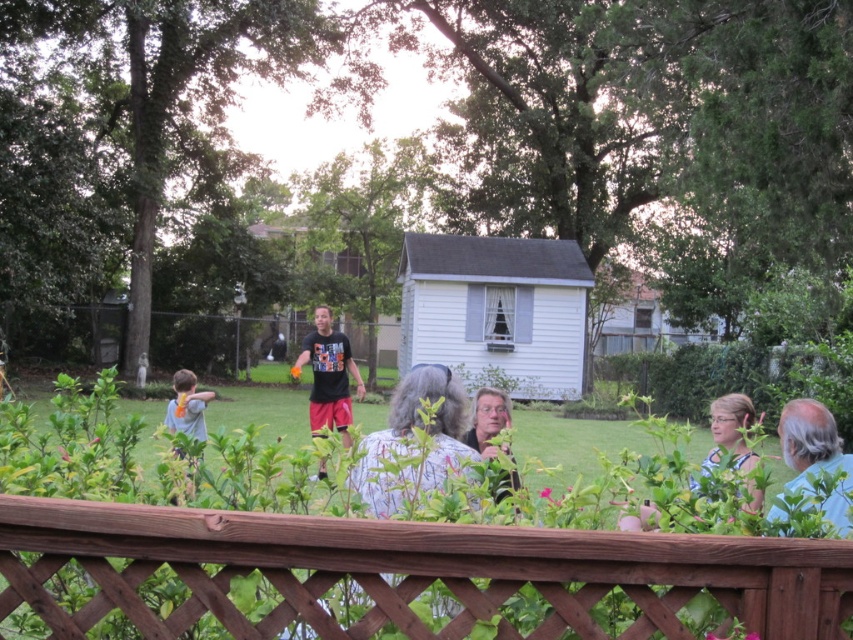
You are standing in the backyard and see the brown wooden fence at lower center and the light blue shirt at left. Which object is positioned to the right side from your perspective?

The brown wooden fence at lower center is to the right of the light blue shirt at left, so the brown wooden fence at lower center is positioned to the right side.

Consider the image. You are a photographer trying to capture a clear shot of the light blue shirt at left. However, the wooden fence at center is blocking your view. Can you move to the right to get a better angle?

The light blue shirt at left is behind the wooden fence at center, so moving to the right might allow you to see around the fence and capture the light blue shirt at left more clearly.